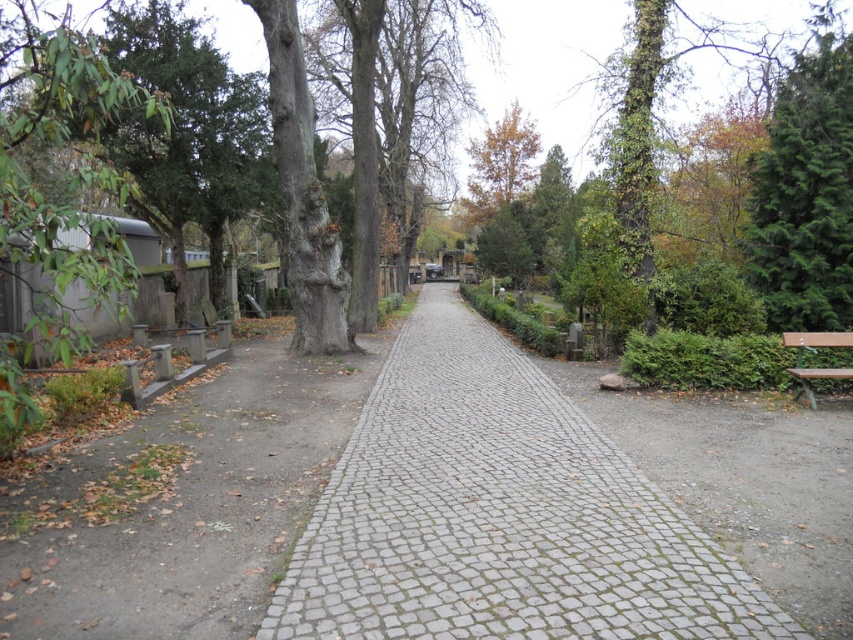
Question: Among these points, which one is nearest to the camera?

Choices:
 (A) (666, 561)
 (B) (804, 378)
 (C) (846, 90)

Answer: (A)

Question: Which object appears closest to the camera in this image?

Choices:
 (A) green textured evergreen tree at right
 (B) brown wooden bench at right
 (C) gray cobblestone path at center

Answer: (C)

Question: Which point is farther to the camera?

Choices:
 (A) gray cobblestone path at center
 (B) green textured evergreen tree at right
 (C) brown wooden bench at right

Answer: (B)

Question: Is gray cobblestone path at center to the right of green textured evergreen tree at right from the viewer's perspective?

Choices:
 (A) yes
 (B) no

Answer: (B)

Question: Can you confirm if green textured evergreen tree at right is positioned below brown wooden bench at right?

Choices:
 (A) no
 (B) yes

Answer: (A)

Question: Does gray cobblestone path at center have a greater width compared to brown wooden bench at right?

Choices:
 (A) yes
 (B) no

Answer: (A)